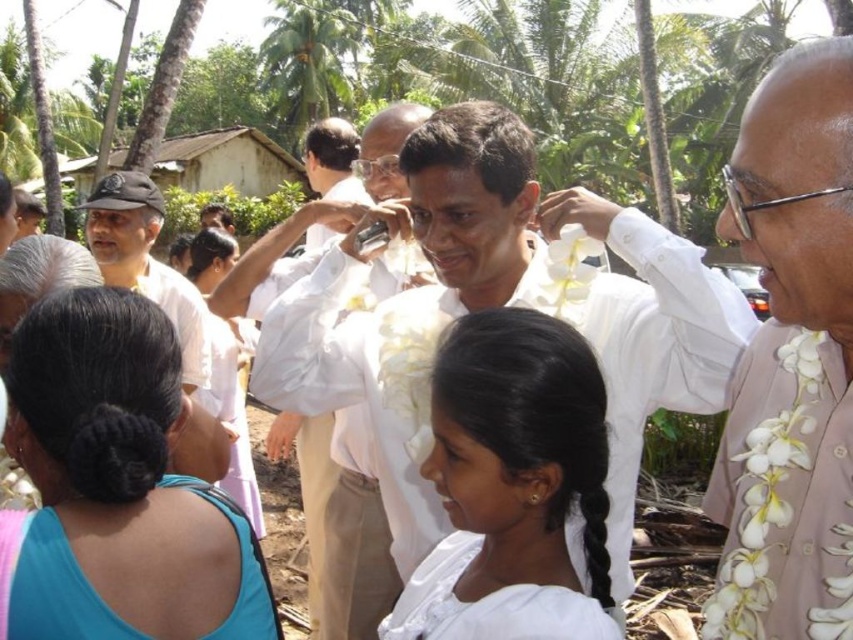
You are organizing a picnic and need to decide which item to use as a tablecloth. You have the white fabric at center and the white cloth shirt at center available. Based on their sizes, which one would be more suitable for covering a standard picnic table?

The white cloth shirt at center is larger than the white fabric at center, so it would be more suitable for covering a standard picnic table.

Looking at this image, you are a photographer at the event and want to capture both the light brown textured shirt at right and the blue fabric hair tie at upper left in the same frame. Which object should you focus on first to ensure both are in focus?

The light brown textured shirt at right is much taller than the blue fabric hair tie at upper left, so focusing on the light brown textured shirt at right first will help ensure both are in focus.

You are at a tropical event and see two people wearing the light brown textured shirt at right and the white cloth shirt at center. Which person is standing more to the left?

The white cloth shirt at center is more to the left because the light brown textured shirt at right is positioned on the right side of it.